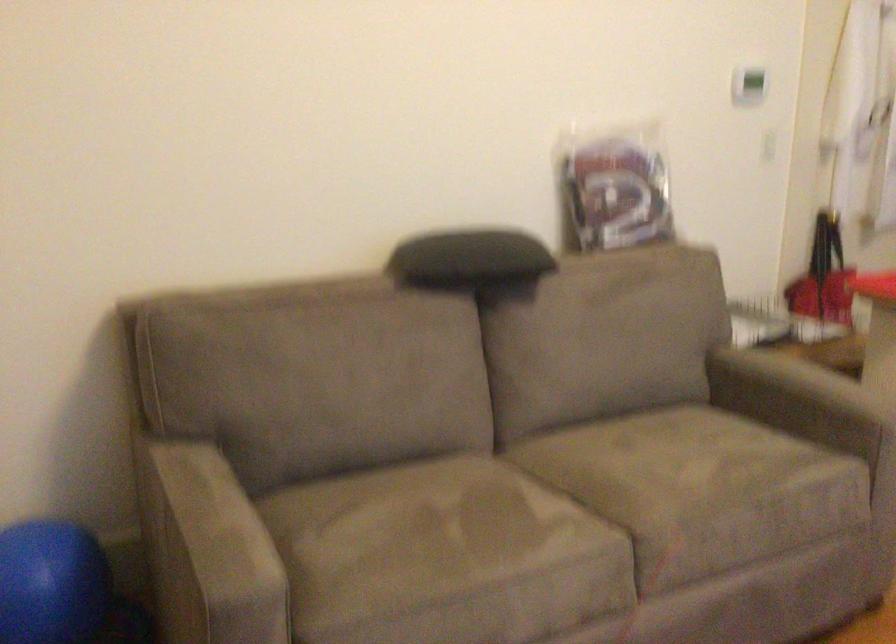
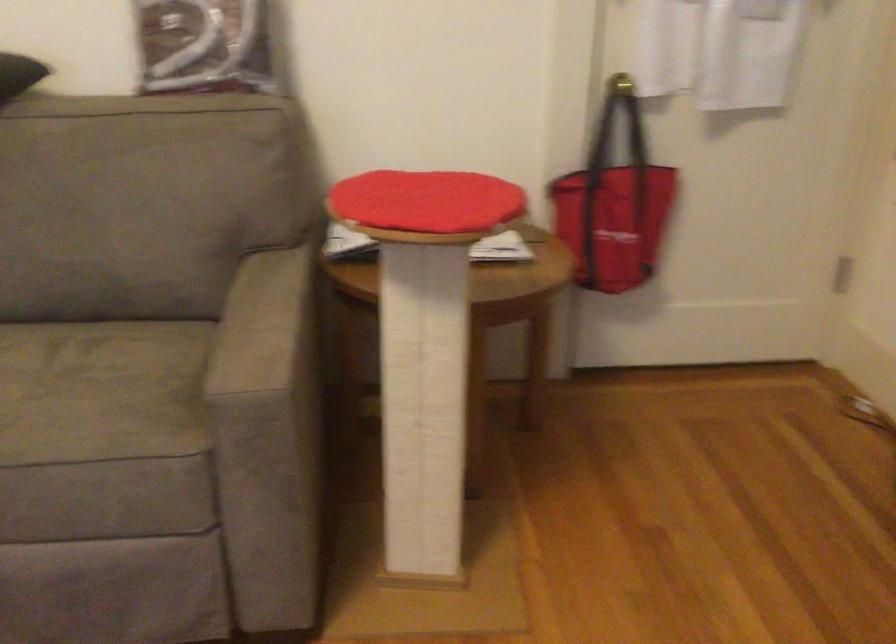
The point at (825, 384) is marked in the first image. Where is the corresponding point in the second image?

(263, 325)